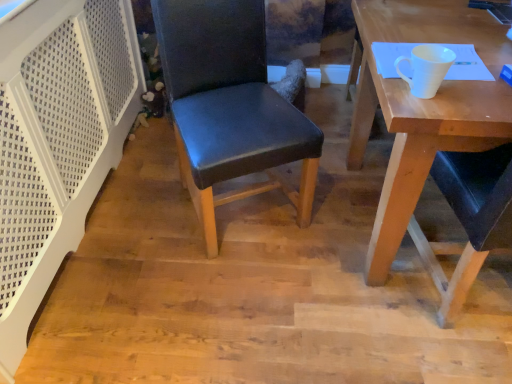
Image resolution: width=512 pixels, height=384 pixels. In order to click on free space to the left of wooden desk at right in this screenshot , I will do `click(258, 271)`.